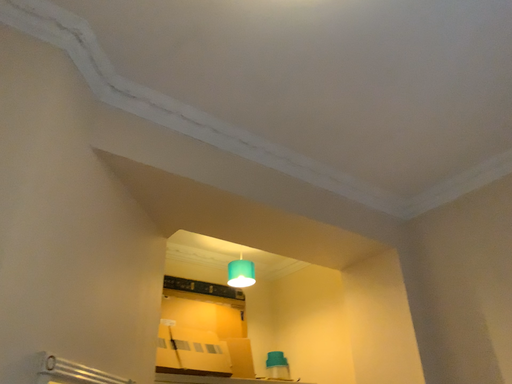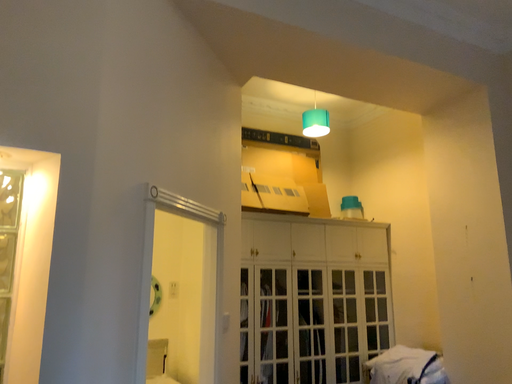
Question: Which way did the camera rotate in the video?

Choices:
 (A) rotated right
 (B) rotated left

Answer: (B)